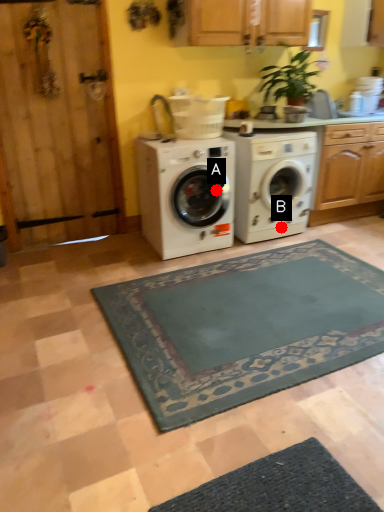
Question: Two points are circled on the image, labeled by A and B beside each circle. Among these points, which one is farthest from the camera?

Choices:
 (A) A is further
 (B) B is further

Answer: (B)